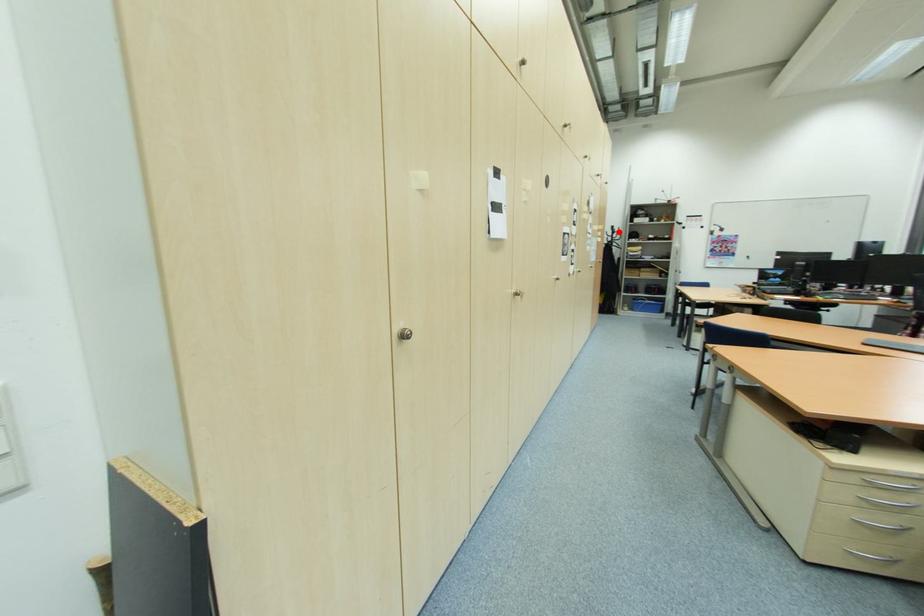
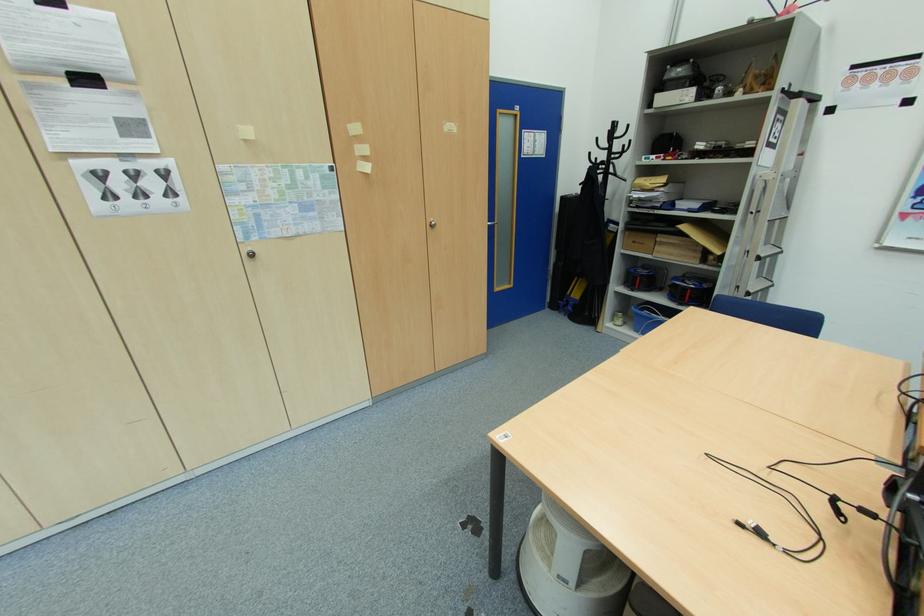
The point at the highlighted location is marked in the first image. Where is the corresponding point in the second image?

(619, 136)